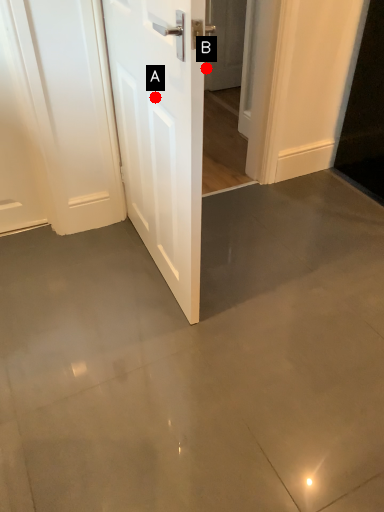
Question: Two points are circled on the image, labeled by A and B beside each circle. Which point is closer to the camera?

Choices:
 (A) A is closer
 (B) B is closer

Answer: (A)